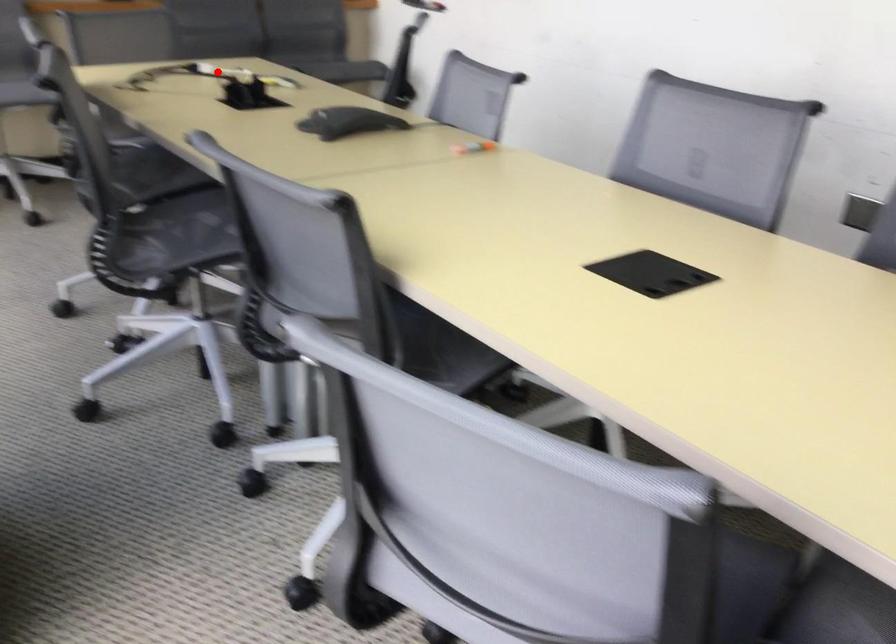
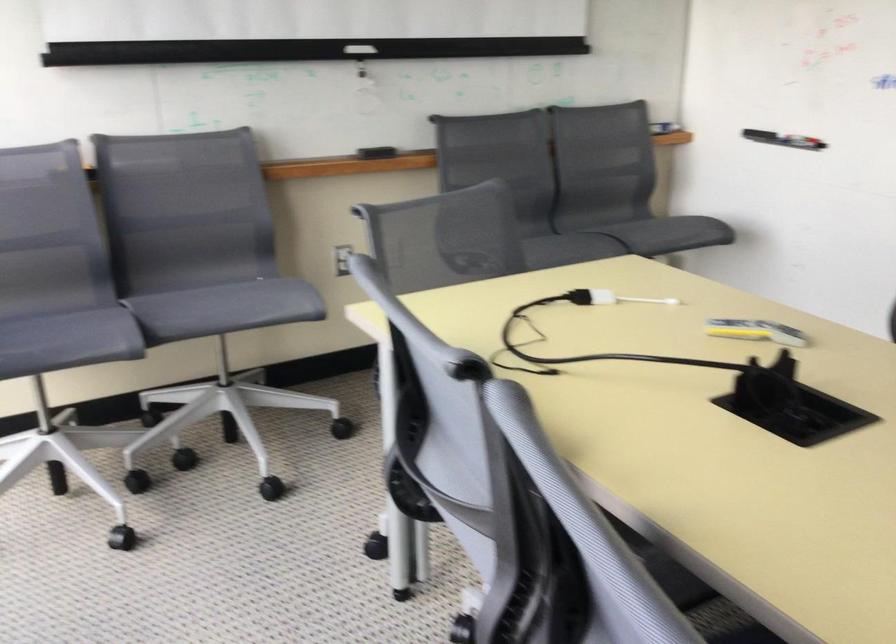
Question: I am providing you with two images of the same scene from different viewpoints. A red point is shown in image1. For the corresponding object point in image2, is it positioned nearer or farther from the camera?

Choices:
 (A) Nearer
 (B) Farther

Answer: (A)